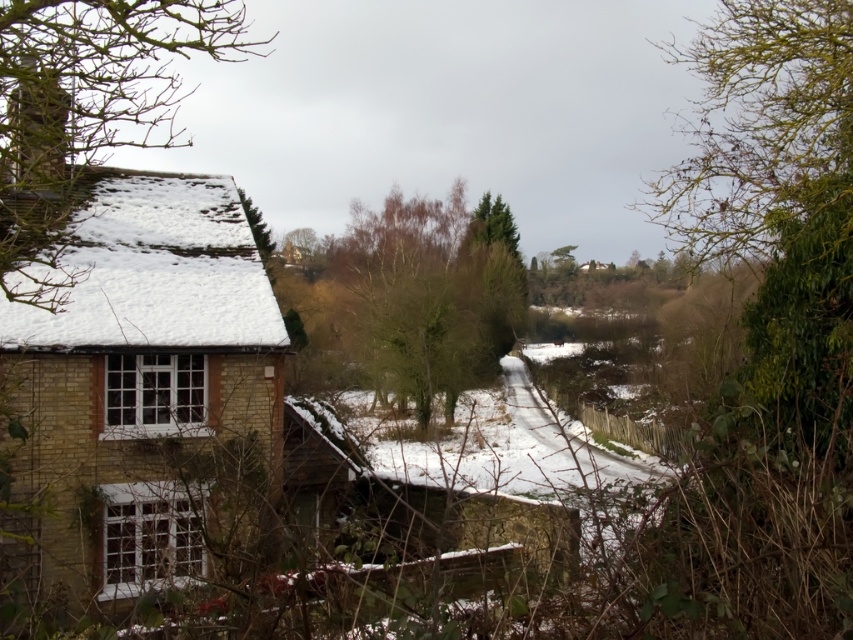
Question: Is bare branches at left positioned in front of brown textured tree at center?

Choices:
 (A) no
 (B) yes

Answer: (B)

Question: From the image, what is the correct spatial relationship of bare branches at left in relation to brown textured tree at center?

Choices:
 (A) right
 (B) left

Answer: (B)

Question: Is bare branches at left closer to the viewer compared to white fluffy roof at left?

Choices:
 (A) yes
 (B) no

Answer: (A)

Question: Which of the following is the farthest from the observer?

Choices:
 (A) (352, 330)
 (B) (141, 240)
 (C) (97, 557)

Answer: (A)

Question: Which point is closer to the camera?

Choices:
 (A) (442, 310)
 (B) (56, 472)
 (C) (223, 189)

Answer: (B)

Question: Which of the following is the farthest from the observer?

Choices:
 (A) (233, 308)
 (B) (15, 310)

Answer: (A)